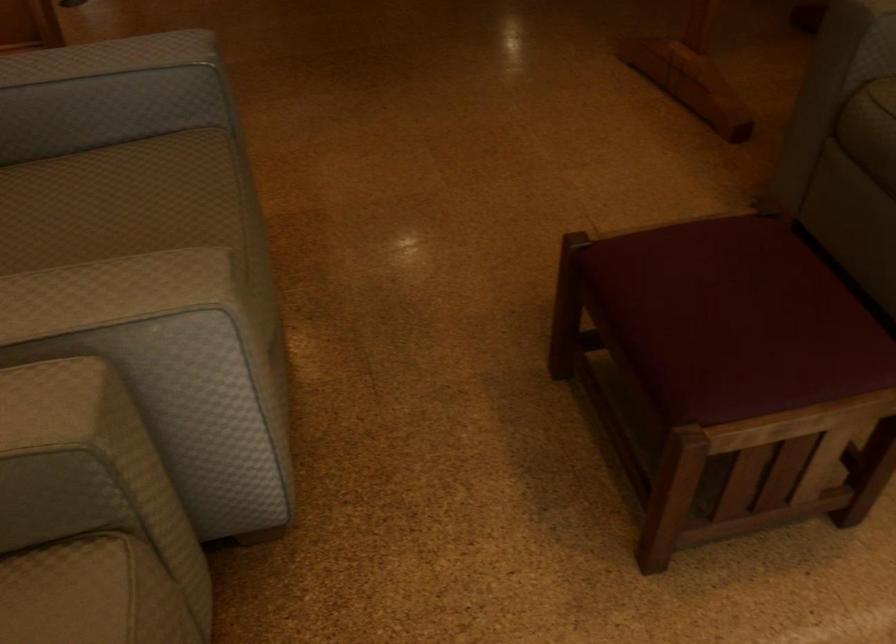
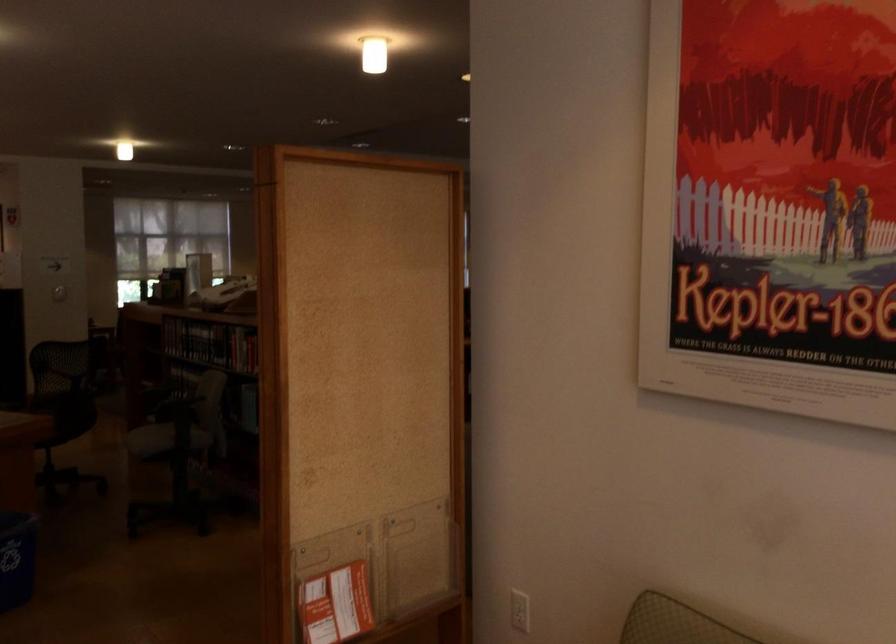
The images are taken continuously from a first-person perspective. In which direction is your viewpoint rotating?

The camera rotated toward right-up.